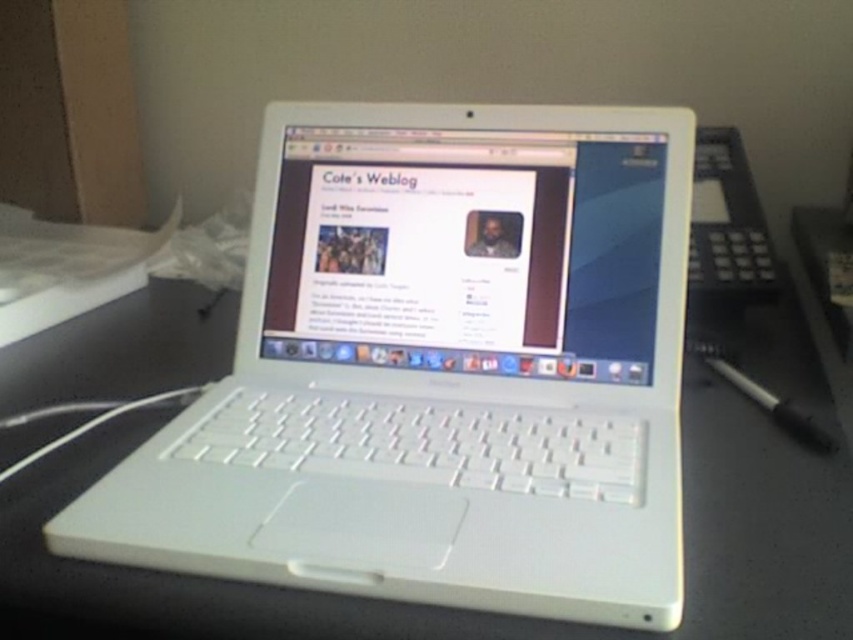
From the picture: Does white plastic laptop at center have a greater height compared to black plastic pen at lower right?

Correct, white plastic laptop at center is much taller as black plastic pen at lower right.

Consider the image. Is white plastic laptop at center further to the viewer compared to black plastic pen at lower right?

No, white plastic laptop at center is in front of black plastic pen at lower right.

Is point (189, 448) less distant than point (781, 406)?

Yes, it is in front of point (781, 406).

Identify the location of white plastic laptop at center. (438, 369).

Between point (608, 253) and point (795, 413), which one is positioned behind?

The point (608, 253) is more distant.

Where is `white glossy laptop screen at center`? white glossy laptop screen at center is located at coordinates click(467, 252).

Is point (241, 326) closer to camera compared to point (582, 198)?

No, (241, 326) is further to viewer.

Does point (316, 465) come behind point (572, 308)?

No, (316, 465) is in front of (572, 308).

This screenshot has width=853, height=640. I want to click on white plastic laptop at center, so click(438, 369).

You are a GUI agent. You are given a task and a screenshot of the screen. Output one action in this format:
    pyautogui.click(x=<x>, y=<y>)
    Task: Click on the white plastic laptop at center
    Image resolution: width=853 pixels, height=640 pixels.
    Given the screenshot: What is the action you would take?
    pyautogui.click(x=438, y=369)